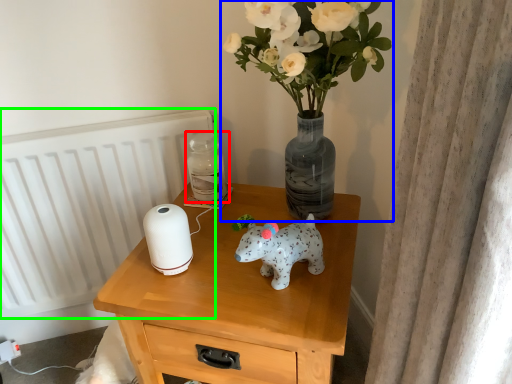
Question: Which is nearer to the bottle (highlighted by a red box)? houseplant (highlighted by a blue box) or radiator (highlighted by a green box).

Choices:
 (A) houseplant
 (B) radiator

Answer: (A)